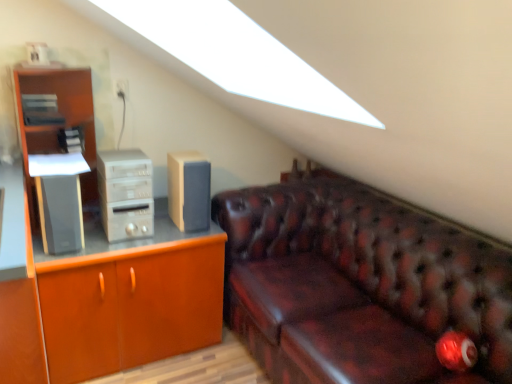
Describe the element at coordinates (189, 190) in the screenshot. I see `beige fabric speaker at center, which is the first speaker from right to left` at that location.

Describe the element at coordinates (125, 194) in the screenshot. I see `satin silver computer tower at left` at that location.

What is the approximate height of matte wood cabinet at left?

matte wood cabinet at left is 24.28 inches tall.

Locate an element on the screen. This screenshot has height=384, width=512. satin black speaker at left, the 1th speaker in the left-to-right sequence is located at coordinates (60, 213).

Is satin black speaker at left, the 1th speaker in the left-to-right sequence, turned away from beige fabric speaker at center, which is the first speaker from right to left?

No, satin black speaker at left, the 1th speaker in the left-to-right sequence, is not facing away from beige fabric speaker at center, which is the first speaker from right to left.

Is satin black speaker at left, which is counted as the second speaker, starting from the right, not close to beige fabric speaker at center, which is the first speaker from right to left?

No, there isn't a large distance between satin black speaker at left, which is counted as the second speaker, starting from the right, and beige fabric speaker at center, which is the first speaker from right to left.

Between satin black speaker at left, which is counted as the second speaker, starting from the right, and beige fabric speaker at center, which is the first speaker from right to left, which one appears on the left side from the viewer's perspective?

satin black speaker at left, which is counted as the second speaker, starting from the right.

Looking at their sizes, would you say satin black speaker at left, the 1th speaker in the left-to-right sequence, is wider or thinner than beige fabric speaker at center, the 2th speaker when ordered from left to right?

Considering their sizes, satin black speaker at left, the 1th speaker in the left-to-right sequence, looks slimmer than beige fabric speaker at center, the 2th speaker when ordered from left to right.

Between satin silver computer tower at left and leather couch at right, which one has smaller size?

satin silver computer tower at left.

Is satin silver computer tower at left spatially inside leather couch at right, or outside of it?

satin silver computer tower at left is located beyond the bounds of leather couch at right.

You are a GUI agent. You are given a task and a screenshot of the screen. Output one action in this format:
    pyautogui.click(x=<x>, y=<y>)
    Task: Click on the studio couch on the right of satin silver computer tower at left
    
    Given the screenshot: What is the action you would take?
    pyautogui.click(x=359, y=286)

Is satin silver computer tower at left looking in the opposite direction of leather couch at right?

No, satin silver computer tower at left is not facing the opposite direction of leather couch at right.

In terms of width, does leather couch at right look wider or thinner when compared to satin silver computer tower at left?

Considering their sizes, leather couch at right looks broader than satin silver computer tower at left.

Is leather couch at right positioned behind satin silver computer tower at left?

That is False.

Is there a large distance between leather couch at right and satin silver computer tower at left?

That's not correct — leather couch at right is a little close to satin silver computer tower at left.

Image resolution: width=512 pixels, height=384 pixels. I want to click on studio couch directly beneath the satin silver computer tower at left (from a real-world perspective), so click(359, 286).

From the picture: From a real-world perspective, is satin black speaker at left, the 1th speaker in the left-to-right sequence, over matte wood cabinet at left?

Correct, in the physical world, satin black speaker at left, the 1th speaker in the left-to-right sequence, is higher than matte wood cabinet at left.

From the image's perspective, is satin black speaker at left, the 1th speaker in the left-to-right sequence, below matte wood cabinet at left?

No, from the image's perspective, satin black speaker at left, the 1th speaker in the left-to-right sequence, is not below matte wood cabinet at left.

In the scene shown: Is satin black speaker at left, the 1th speaker in the left-to-right sequence, facing towards matte wood cabinet at left?

No, satin black speaker at left, the 1th speaker in the left-to-right sequence, does not turn towards matte wood cabinet at left.

Which of these two, satin black speaker at left, the 1th speaker in the left-to-right sequence, or matte wood cabinet at left, is smaller?

Smaller between the two is satin black speaker at left, the 1th speaker in the left-to-right sequence.

From the picture: Which of these two, satin black speaker at left, the 1th speaker in the left-to-right sequence, or satin silver computer tower at left, stands taller?

Standing taller between the two is satin silver computer tower at left.

From the image's perspective, is satin black speaker at left, the 1th speaker in the left-to-right sequence, below satin silver computer tower at left?

Indeed, from the image's perspective, satin black speaker at left, the 1th speaker in the left-to-right sequence, is shown beneath satin silver computer tower at left.

Is point (55, 193) less distant than point (120, 194)?

Yes.

Would you say satin black speaker at left, the 1th speaker in the left-to-right sequence, is outside satin silver computer tower at left?

Yes.

Does satin silver computer tower at left have a larger size compared to matte wood cabinet at left?

Incorrect, satin silver computer tower at left is not larger than matte wood cabinet at left.

Considering the relative positions of satin silver computer tower at left and matte wood cabinet at left in the image provided, is satin silver computer tower at left to the right of matte wood cabinet at left from the viewer's perspective?

Yes.

From the image's perspective, which one is positioned lower, satin silver computer tower at left or matte wood cabinet at left?

matte wood cabinet at left, from the image's perspective.

From a real-world perspective, is satin silver computer tower at left under matte wood cabinet at left?

Actually, satin silver computer tower at left is physically above matte wood cabinet at left in the real world.

Consider the image. Is leather couch at right aimed at satin black speaker at left, the 1th speaker in the left-to-right sequence?

Yes, leather couch at right is turned towards satin black speaker at left, the 1th speaker in the left-to-right sequence.

From the image's perspective, between leather couch at right and satin black speaker at left, which is counted as the second speaker, starting from the right, which one is located above?

satin black speaker at left, which is counted as the second speaker, starting from the right, appears higher in the image.

Is leather couch at right not close to satin black speaker at left, the 1th speaker in the left-to-right sequence?

Absolutely, leather couch at right is distant from satin black speaker at left, the 1th speaker in the left-to-right sequence.

In order to click on speaker that appears in front of the beige fabric speaker at center, which is the first speaker from right to left in this screenshot , I will do `click(60, 213)`.

Where is `studio couch below the satin silver computer tower at left (from the image's perspective)`? This screenshot has width=512, height=384. studio couch below the satin silver computer tower at left (from the image's perspective) is located at coordinates (359, 286).

Based on their spatial positions, is satin black speaker at left, which is counted as the second speaker, starting from the right, or matte wood cabinet at left closer to leather couch at right?

Among the two, matte wood cabinet at left is located nearer to leather couch at right.

Looking at the image, which one is located closer to satin silver computer tower at left, beige fabric speaker at center, the 2th speaker when ordered from left to right, or matte wood cabinet at left?

beige fabric speaker at center, the 2th speaker when ordered from left to right, is positioned closer to the anchor satin silver computer tower at left.

Which object lies nearer to the anchor point beige fabric speaker at center, the 2th speaker when ordered from left to right, matte wood cabinet at left or satin black speaker at left, the 1th speaker in the left-to-right sequence?

matte wood cabinet at left is positioned closer to the anchor beige fabric speaker at center, the 2th speaker when ordered from left to right.

Looking at the image, which one is located closer to matte wood cabinet at left, satin black speaker at left, the 1th speaker in the left-to-right sequence, or satin silver computer tower at left?

Based on the image, satin silver computer tower at left appears to be nearer to matte wood cabinet at left.

Which object lies nearer to the anchor point satin black speaker at left, the 1th speaker in the left-to-right sequence, beige fabric speaker at center, the 2th speaker when ordered from left to right, or satin silver computer tower at left?

The object closer to satin black speaker at left, the 1th speaker in the left-to-right sequence, is satin silver computer tower at left.

Considering their positions, is satin black speaker at left, which is counted as the second speaker, starting from the right, positioned closer to leather couch at right than satin silver computer tower at left?

Among the two, satin silver computer tower at left is located nearer to leather couch at right.

Looking at the image, which one is located closer to beige fabric speaker at center, the 2th speaker when ordered from left to right, leather couch at right or satin black speaker at left, which is counted as the second speaker, starting from the right?

satin black speaker at left, which is counted as the second speaker, starting from the right, is closer to beige fabric speaker at center, the 2th speaker when ordered from left to right.

When comparing their distances from beige fabric speaker at center, the 2th speaker when ordered from left to right, does satin black speaker at left, the 1th speaker in the left-to-right sequence, or satin silver computer tower at left seem closer?

Among the two, satin silver computer tower at left is located nearer to beige fabric speaker at center, the 2th speaker when ordered from left to right.

I want to click on computer tower situated between satin black speaker at left, which is counted as the second speaker, starting from the right, and leather couch at right from left to right, so [125, 194].

Locate an element on the screen. The width and height of the screenshot is (512, 384). computer tower between matte wood cabinet at left and leather couch at right is located at coordinates (125, 194).

Find the location of a particular element. This screenshot has height=384, width=512. speaker between satin black speaker at left, which is counted as the second speaker, starting from the right, and leather couch at right is located at coordinates (189, 190).

Locate an element on the screen. speaker between satin silver computer tower at left and leather couch at right is located at coordinates (x=189, y=190).